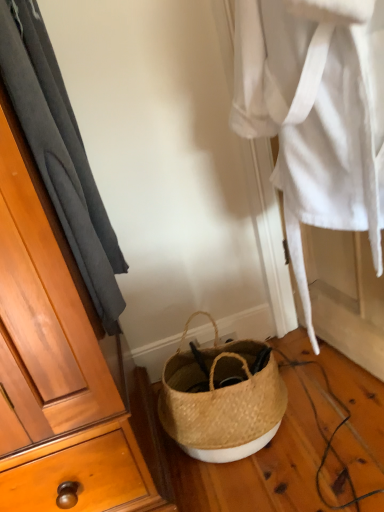
Where is `white woven robe at center`? white woven robe at center is located at coordinates (314, 121).

The width and height of the screenshot is (384, 512). Describe the element at coordinates (221, 400) in the screenshot. I see `natural woven basket at lower center` at that location.

Locate an element on the screen. dark gray fabric at left is located at coordinates (60, 153).

Is white woven robe at center inside the boundaries of dark gray fabric at left, or outside?

white woven robe at center is outside dark gray fabric at left.

From a real-world perspective, does white woven robe at center sit lower than dark gray fabric at left?

Yes, from a real-world perspective, white woven robe at center is below dark gray fabric at left.

Is white woven robe at center wider than dark gray fabric at left?

Yes, white woven robe at center is wider than dark gray fabric at left.

Can you confirm if white woven robe at center is bigger than dark gray fabric at left?

Yes, white woven robe at center is bigger than dark gray fabric at left.

Considering the relative sizes of white woven robe at center and natural woven basket at lower center in the image provided, is white woven robe at center bigger than natural woven basket at lower center?

Correct, white woven robe at center is larger in size than natural woven basket at lower center.

From their relative heights in the image, would you say white woven robe at center is taller or shorter than natural woven basket at lower center?

Considering their sizes, white woven robe at center has more height than natural woven basket at lower center.

Can you tell me how much white woven robe at center and natural woven basket at lower center differ in facing direction?

white woven robe at center and natural woven basket at lower center are facing 78.6 degrees away from each other.

Is white woven robe at center in front of natural woven basket at lower center?

Yes, it is in front of natural woven basket at lower center.

Measure the distance from natural woven basket at lower center to white woven robe at center.

natural woven basket at lower center is 52.32 centimeters from white woven robe at center.

Which is closer to the camera, (181, 387) or (326, 153)?

Point (181, 387) is farther from the camera than point (326, 153).

At what (x,y) coordinates should I click in order to perform the action: click on clothing on the right of natural woven basket at lower center. Please return your answer as a coordinate pair (x, y). Image resolution: width=384 pixels, height=512 pixels. Looking at the image, I should click on (314, 121).

Does natural woven basket at lower center have a greater width compared to white woven robe at center?

In fact, natural woven basket at lower center might be narrower than white woven robe at center.

Could you tell me if dark gray fabric at left is facing white woven robe at center?

Yes.

Does dark gray fabric at left have a lesser width compared to white woven robe at center?

Yes, dark gray fabric at left is thinner than white woven robe at center.

Visually, is dark gray fabric at left positioned to the left or to the right of white woven robe at center?

dark gray fabric at left is to the left of white woven robe at center.

Is dark gray fabric at left surrounding natural woven basket at lower center?

Definitely not — natural woven basket at lower center is not inside dark gray fabric at left.

Is dark gray fabric at left oriented towards natural woven basket at lower center?

No, dark gray fabric at left is not facing towards natural woven basket at lower center.

Consider the image. Can you see dark gray fabric at left touching natural woven basket at lower center?

No, dark gray fabric at left is not touching natural woven basket at lower center.

Is dark gray fabric at left thinner than natural woven basket at lower center?

→ Yes.

How many degrees apart are the facing directions of natural woven basket at lower center and dark gray fabric at left?

The angular difference between natural woven basket at lower center and dark gray fabric at left is 90.5 degrees.

From the image's perspective, between natural woven basket at lower center and dark gray fabric at left, who is located below?

natural woven basket at lower center appears lower in the image.

Is natural woven basket at lower center located outside dark gray fabric at left?

natural woven basket at lower center lies outside dark gray fabric at left's area.

From their relative heights in the image, would you say natural woven basket at lower center is taller or shorter than dark gray fabric at left?

natural woven basket at lower center is shorter than dark gray fabric at left.

This screenshot has width=384, height=512. In order to click on clothing below the dark gray fabric at left (from a real-world perspective) in this screenshot , I will do `click(314, 121)`.

Identify the location of clothing in front of the natural woven basket at lower center. (314, 121).

Based on their spatial positions, is dark gray fabric at left or white woven robe at center closer to natural woven basket at lower center?

The object closer to natural woven basket at lower center is white woven robe at center.

From the picture: Based on their spatial positions, is dark gray fabric at left or natural woven basket at lower center further from white woven robe at center?

natural woven basket at lower center is positioned further to the anchor white woven robe at center.

From the image, which object appears to be nearer to white woven robe at center, natural woven basket at lower center or dark gray fabric at left?

dark gray fabric at left.

Based on the photo, estimate the real-world distances between objects in this image. Which object is closer to natural woven basket at lower center, white woven robe at center or dark gray fabric at left?

Based on the image, white woven robe at center appears to be nearer to natural woven basket at lower center.

Consider the image. When comparing their distances from dark gray fabric at left, does natural woven basket at lower center or white woven robe at center seem further?

The object further to dark gray fabric at left is natural woven basket at lower center.

From the image, which object appears to be farther from dark gray fabric at left, white woven robe at center or natural woven basket at lower center?

The object further to dark gray fabric at left is natural woven basket at lower center.

Image resolution: width=384 pixels, height=512 pixels. Find the location of `clothing between dark gray fabric at left and natural woven basket at lower center vertically`. clothing between dark gray fabric at left and natural woven basket at lower center vertically is located at coordinates (314, 121).